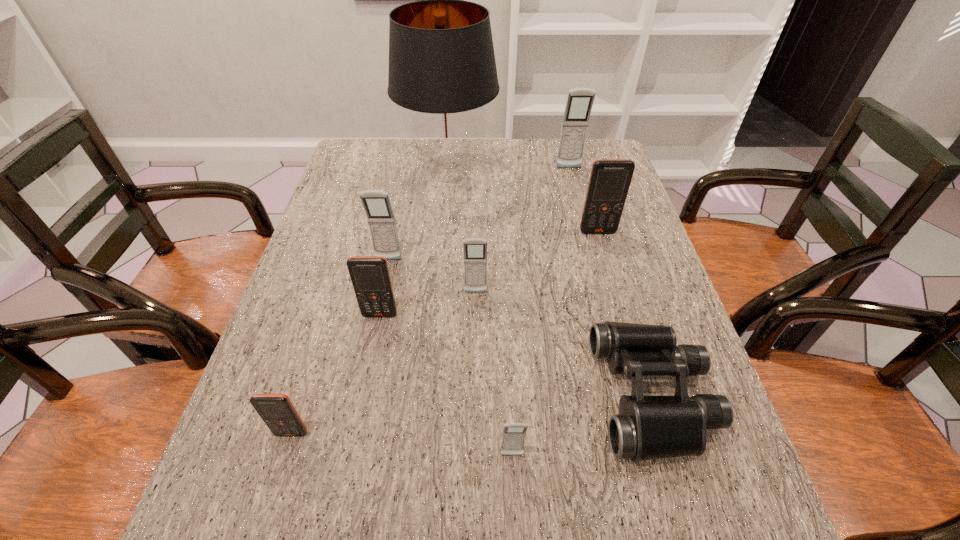
You are a GUI agent. You are given a task and a screenshot of the screen. Output one action in this format:
    pyautogui.click(x=<x>, y=<y>)
    Task: Click on the object positioned at the left edge
    The height and width of the screenshot is (540, 960).
    Given the screenshot: What is the action you would take?
    pyautogui.click(x=277, y=411)

Find the location of `binoculars present at the right edge`. binoculars present at the right edge is located at coordinates (649, 427).

Identify the location of object at the far right corner. (579, 103).

This screenshot has width=960, height=540. In order to click on vacant space at the far edge of the desktop in this screenshot , I will do `click(505, 164)`.

In the image, there is a desktop. In order to click on free region at the near edge in this screenshot , I will do `click(618, 517)`.

Identify the location of vacant space at the left edge of the desktop. This screenshot has height=540, width=960. (309, 273).

The image size is (960, 540). In the image, there is a desktop. Identify the location of vacant space at the right edge. (619, 289).

In the image, there is a desktop. At what (x,y) coordinates should I click in order to perform the action: click on vacant space at the far left corner. Please return your answer as a coordinate pair (x, y). The height and width of the screenshot is (540, 960). Looking at the image, I should click on (360, 177).

In the image, there is a desktop. Where is `vacant space at the far right corner`? The width and height of the screenshot is (960, 540). vacant space at the far right corner is located at coordinates (588, 171).

Where is `vacant region between the gray lampshade and the second farthest gray cellular telephone`? The height and width of the screenshot is (540, 960). vacant region between the gray lampshade and the second farthest gray cellular telephone is located at coordinates (419, 217).